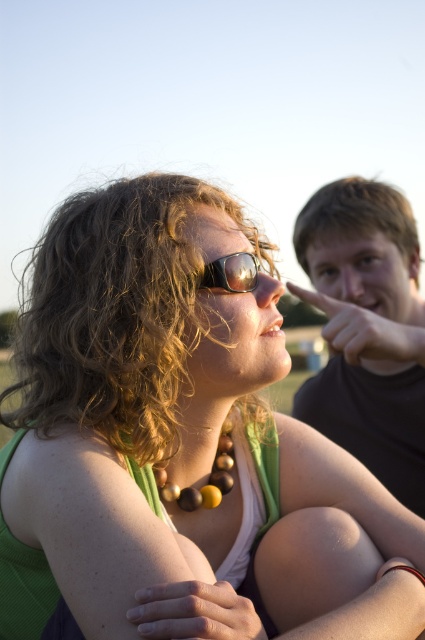
You are standing in the scene and see two points marked as point 1 at coordinates (70, 476) and point 2 at coordinates (391, 436). Which point is closer to you?

Point 1 at coordinates (70, 476) is closer to you than point 2 at coordinates (391, 436) because the description states that point (70, 476) is closer to the camera than point (391, 436).

You are a photographer trying to capture a closeup of the green matte necklace at upper center and the sunglasses at center. Which object should you zoom in more on to ensure both are in focus?

The green matte necklace at upper center is larger in size than sunglasses at center, so you should zoom in more on the sunglasses at center to ensure both are in focus.